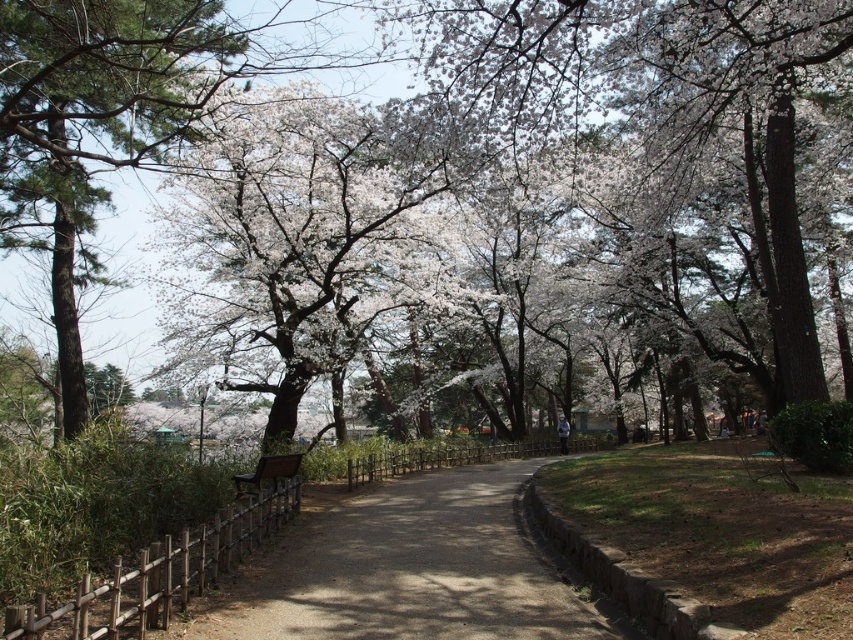
You are planning to place a new bench exactly the same size as the wooden bench at center along the park path. Considering the space occupied by the smooth bark tree at left, will there be enough room to place the new bench without overlapping with the tree?

The smooth bark tree at left is wider than the wooden bench at center. Since the new bench would be the same size as the existing one, placing it near the tree might not leave enough space, as the tree occupies a larger area. Ensure there is sufficient clearance before placing the new bench.

You are planning to place a small birdhouse on the path between the white blossoms at center and the wooden bench at center. Which object should you place it closer to so that it doesn

The white blossoms at center are wider than the wooden bench at center. Therefore, placing the birdhouse closer to the white blossoms at center would allow more space between them and the bench.

You are standing on the park path and want to take a photo of the white blossoming tree at center. Your camera has a maximum focus range of 12 meters. Will you be able to focus on the tree?

The white blossoming tree at center is 13.53 meters away from viewer, which is beyond the camera maximum focus range of 12 meters. So you cannot focus on the tree.